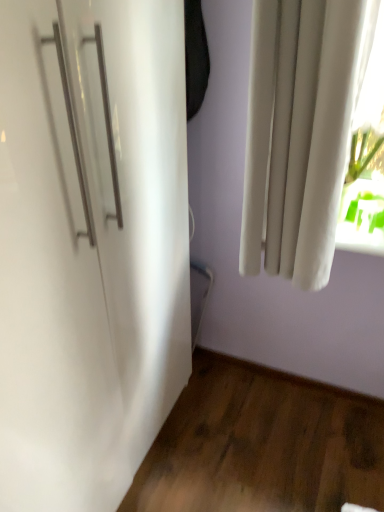
Where is `white matte curtain at right`? white matte curtain at right is located at coordinates (298, 134).

The image size is (384, 512). What do you see at coordinates (298, 134) in the screenshot?
I see `white matte curtain at right` at bounding box center [298, 134].

Looking at this image, in order to face white matte curtain at right, should I rotate leftwards or rightwards?

Rotate right and turn 14.352 degrees.

At what (x,y) coordinates should I click in order to perform the action: click on white matte curtain at right. Please return your answer as a coordinate pair (x, y). The height and width of the screenshot is (512, 384). Looking at the image, I should click on (298, 134).